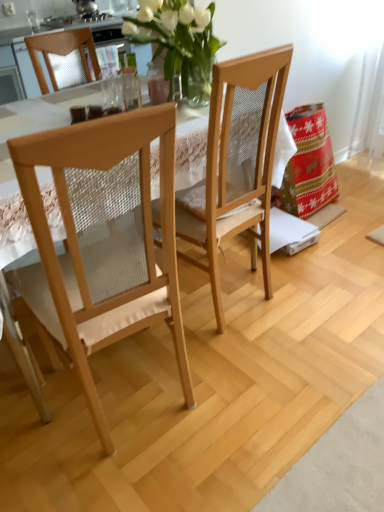
At what (x,y) coordinates should I click in order to perform the action: click on empty space that is to the right of light wood/mesh chair at left, the 2th chair when ordered from right to left. Please return your answer as a coordinate pair (x, y). This screenshot has height=512, width=384. Looking at the image, I should click on (250, 386).